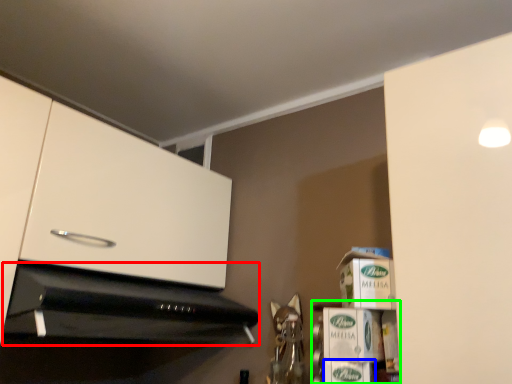
Question: Which object is the closest to the home appliance (highlighted by a red box)? Choose among these: cardboard box (highlighted by a blue box) or shelf (highlighted by a green box).

Choices:
 (A) cardboard box
 (B) shelf

Answer: (B)